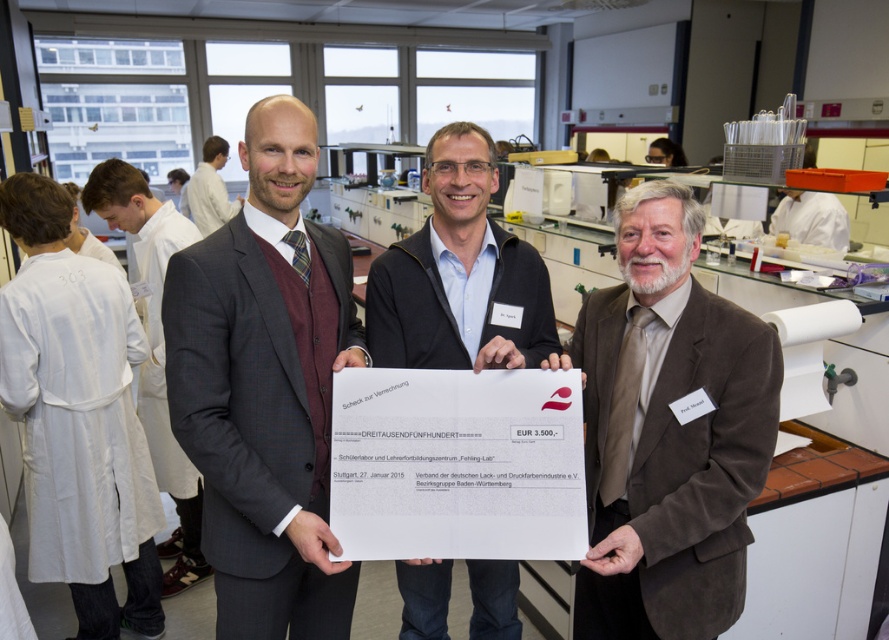
Question: Does white lab coat at left come in front of maroon sweater at center?

Choices:
 (A) yes
 (B) no

Answer: (A)

Question: Which is farther from the white lab coat at left?

Choices:
 (A) matte black suit at center
 (B) brown suede suit at center
 (C) matte black jacket at center

Answer: (B)

Question: Which of the following is the closest to the observer?

Choices:
 (A) white lab coat at left
 (B) matte black jacket at center

Answer: (B)

Question: Does white lab coat at left appear on the left side of maroon sweater at center?

Choices:
 (A) yes
 (B) no

Answer: (B)

Question: Is matte black suit at center wider than brown suede suit at center?

Choices:
 (A) no
 (B) yes

Answer: (A)

Question: Which point is farther to the camera?

Choices:
 (A) (205, 188)
 (B) (425, 314)

Answer: (A)